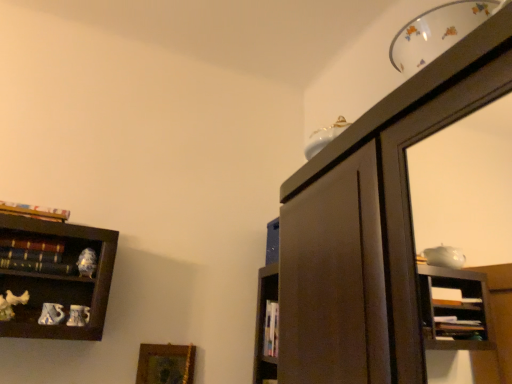
Question: Considering the positions of hardcover book at upper left, positioned as the first book in top-to-bottom order, and hardcover books at left, the 2th book when ordered from top to bottom, in the image, is hardcover book at upper left, positioned as the first book in top-to-bottom order, wider or thinner than hardcover books at left, the 2th book when ordered from top to bottom,?

Choices:
 (A) thin
 (B) wide

Answer: (B)

Question: Would you say hardcover book at upper left, which is the 2th book from bottom to top, is to the left or to the right of hardcover books at left, positioned as the 1th book in bottom-to-top order, in the picture?

Choices:
 (A) left
 (B) right

Answer: (A)

Question: Considering the real-world distances, which object is farthest from the hardcover book at upper left, which is the 2th book from bottom to top?

Choices:
 (A) gold-framed picture at lower left
 (B) hardcover books at left, positioned as the 1th book in bottom-to-top order

Answer: (A)

Question: Considering the real-world distances, which object is closest to the gold-framed picture at lower left?

Choices:
 (A) hardcover book at upper left, positioned as the first book in top-to-bottom order
 (B) hardcover books at left, the 2th book when ordered from top to bottom

Answer: (B)